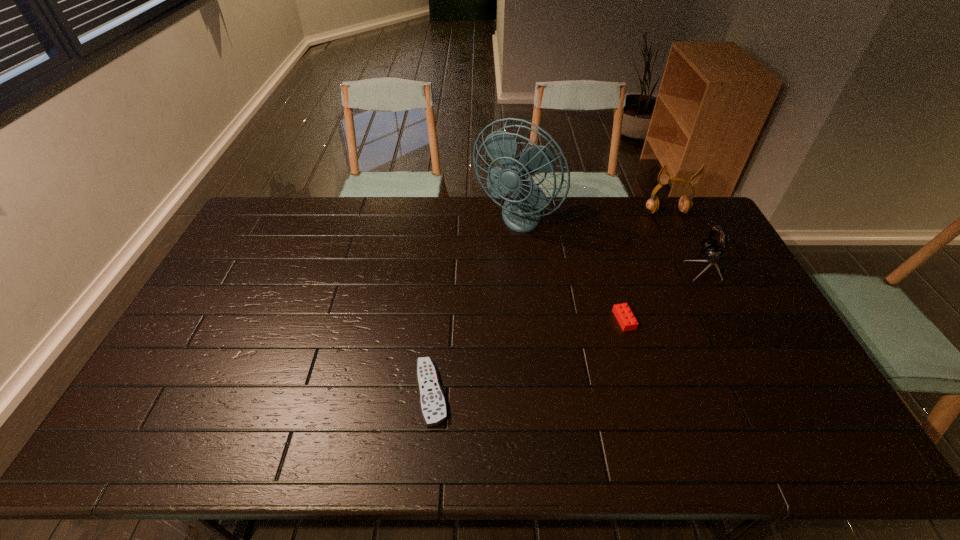
You are a GUI agent. You are given a task and a screenshot of the screen. Output one action in this format:
    pyautogui.click(x=<x>, y=<y>)
    Task: Click on the vacant space positioned 0.050m in front of the tallest object to blow air
    
    Given the screenshot: What is the action you would take?
    (x=518, y=256)

The image size is (960, 540). Identify the location of free point located on the front-facing side of the fourth shortest object. (699, 278).

At what (x,y) coordinates should I click in order to perform the action: click on vacant space situated 0.350m on the back of the shorter earphone. Please return your answer as a coordinate pair (x, y). Looking at the image, I should click on (667, 196).

I want to click on free space located on the back of the Lego, so click(604, 253).

Identify the location of vacant area situated on the left of the leftmost object. The width and height of the screenshot is (960, 540). (273, 393).

This screenshot has width=960, height=540. Identify the location of fan located at the far edge. (521, 212).

Where is `earphone at the far edge`? The height and width of the screenshot is (540, 960). earphone at the far edge is located at coordinates (685, 204).

The height and width of the screenshot is (540, 960). Find the location of `object at the near edge`. object at the near edge is located at coordinates (433, 407).

This screenshot has width=960, height=540. Identify the location of object positioned at the far right corner. (685, 204).

In the image, there is a desktop. In order to click on blank space at the far edge in this screenshot , I will do `click(438, 200)`.